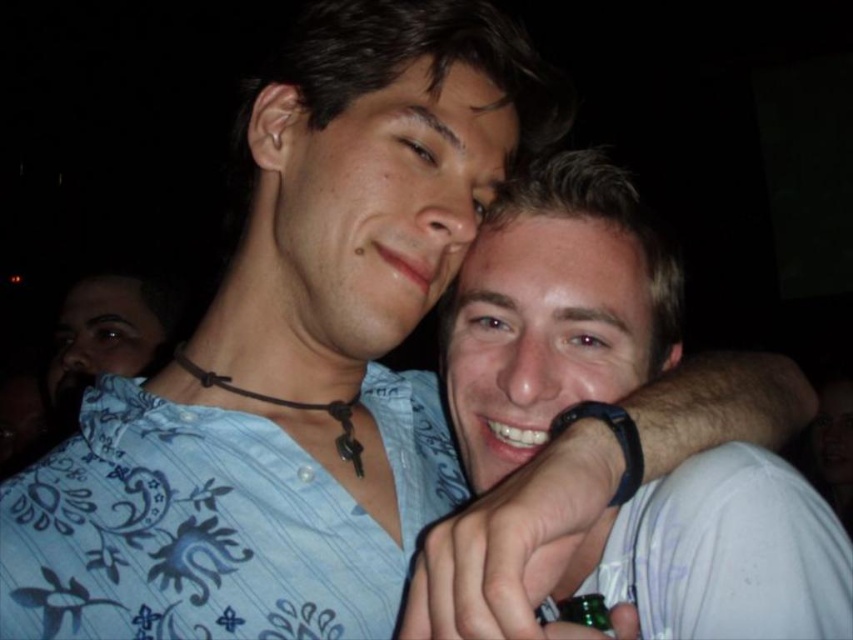
In the scene shown: What are the coordinates of the smooth skin face at center?

The smooth skin face at center is located at coordinates point (540, 333).

You are a photographer at a party and want to take a photo of the matte blue shirt at center and the smooth skin face at center. However, you notice that one of them is blocking the other. Which object is being blocked by the other?

The smooth skin face at center is behind the matte blue shirt at center, so the smooth skin face at center is being blocked by the matte blue shirt at center.